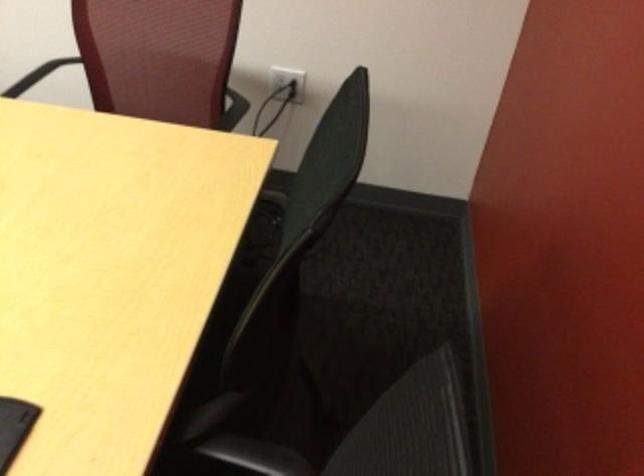
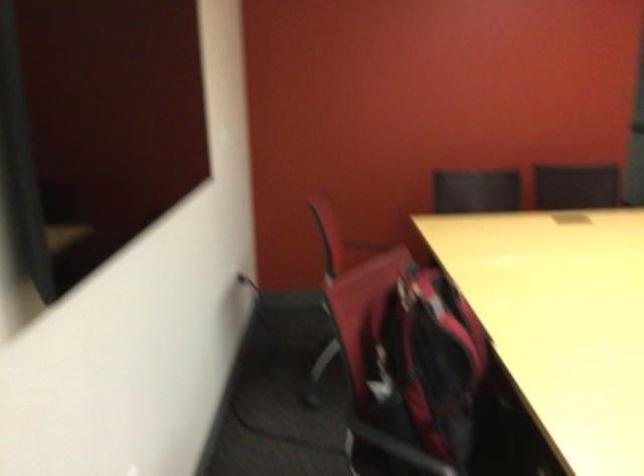
Question: I am providing you with two images of the same scene from different viewpoints. Please identify which objects are invisible in image2.

Choices:
 (A) red and black backpack
 (B) red chair sitting surface
 (C) chair sitting surface
 (D) white pump dispenser top

Answer: (C)